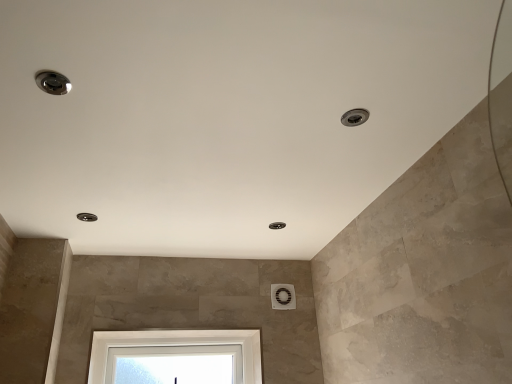
Measure the distance between point (38, 73) and camera.

Point (38, 73) and camera are 3.55 feet apart from each other.

Identify the location of satin nickel droplight at upper right, which ranks as the 2th droplight in front-to-back order. Image resolution: width=512 pixels, height=384 pixels. (355, 117).

What do you see at coordinates (355, 117) in the screenshot? The image size is (512, 384). I see `satin nickel droplight at upper right, which appears as the first droplight when viewed from the right` at bounding box center [355, 117].

I want to click on matte silver droplight at upper left, positioned as the 1th droplight in left-to-right order, so click(87, 217).

Find the location of a particular element. The width and height of the screenshot is (512, 384). satin nickel droplight at upper left, acting as the 3th droplight starting from the back is located at coordinates (53, 82).

Considering the positions of point (84, 219) and point (68, 90), is point (84, 219) closer or farther from the camera than point (68, 90)?

Clearly, point (84, 219) is more distant from the camera than point (68, 90).

Looking at this image, considering the sizes of objects matte silver droplight at upper left, the 1th droplight ordered from the bottom, and satin nickel droplight at upper left, acting as the 3th droplight starting from the back, in the image provided, who is thinner, matte silver droplight at upper left, the 1th droplight ordered from the bottom, or satin nickel droplight at upper left, acting as the 3th droplight starting from the back,?

satin nickel droplight at upper left, acting as the 3th droplight starting from the back.

Can you confirm if matte silver droplight at upper left, the 1th droplight from the back, is smaller than satin nickel droplight at upper left, placed as the third droplight when sorted from bottom to top?

Yes.

From the image's perspective, is satin nickel droplight at upper right, the second droplight positioned from the top, located above or below satin nickel droplight at upper left, acting as the 3th droplight starting from the back?

satin nickel droplight at upper right, the second droplight positioned from the top, is below satin nickel droplight at upper left, acting as the 3th droplight starting from the back.

Considering their positions, is satin nickel droplight at upper right, which ranks as the second droplight in bottom-to-top order, located in front of or behind satin nickel droplight at upper left, the first droplight viewed from the front?

Clearly, satin nickel droplight at upper right, which ranks as the second droplight in bottom-to-top order, is behind satin nickel droplight at upper left, the first droplight viewed from the front.

Identify the location of droplight located above the satin nickel droplight at upper right, the second droplight positioned from the top (from the image's perspective). The width and height of the screenshot is (512, 384). (53, 82).

How much distance is there between satin nickel droplight at upper right, which ranks as the 2th droplight in front-to-back order, and satin nickel droplight at upper left, acting as the 3th droplight starting from the back?

A distance of 32.17 inches exists between satin nickel droplight at upper right, which ranks as the 2th droplight in front-to-back order, and satin nickel droplight at upper left, acting as the 3th droplight starting from the back.

How different are the orientations of satin nickel droplight at upper left, the first droplight viewed from the front, and matte silver droplight at upper left, the 3th droplight in the top-to-bottom sequence, in degrees?

The facing directions of satin nickel droplight at upper left, the first droplight viewed from the front, and matte silver droplight at upper left, the 3th droplight in the top-to-bottom sequence, are 90 degrees apart.

In the scene shown: Could you tell me if satin nickel droplight at upper left, the 2th droplight positioned from the right, is turned towards matte silver droplight at upper left, the 3th droplight viewed from the front?

No, satin nickel droplight at upper left, the 2th droplight positioned from the right, is not aimed at matte silver droplight at upper left, the 3th droplight viewed from the front.

Locate an element on the screen. the 2nd droplight in front of the matte silver droplight at upper left, the 3th droplight in the top-to-bottom sequence, counting from the anchor's position is located at coordinates (53, 82).

Considering the relative positions of satin nickel droplight at upper left, the first droplight viewed from the front, and matte silver droplight at upper left, positioned as the 1th droplight in left-to-right order, in the image provided, is satin nickel droplight at upper left, the first droplight viewed from the front, to the left or to the right of matte silver droplight at upper left, positioned as the 1th droplight in left-to-right order,?

Clearly, satin nickel droplight at upper left, the first droplight viewed from the front, is on the right of matte silver droplight at upper left, positioned as the 1th droplight in left-to-right order, in the image.

Is matte silver droplight at upper left, the 1th droplight from the back, bigger than satin nickel droplight at upper right, which appears as the first droplight when viewed from the right?

Yes.

Is satin nickel droplight at upper right, which appears as the second droplight when viewed from the back, surrounded by matte silver droplight at upper left, the 3th droplight in the top-to-bottom sequence?

No, matte silver droplight at upper left, the 3th droplight in the top-to-bottom sequence, does not contain satin nickel droplight at upper right, which appears as the second droplight when viewed from the back.

This screenshot has height=384, width=512. What are the coordinates of `droplight above the matte silver droplight at upper left, the 3th droplight viewed from the front (from a real-world perspective)` in the screenshot? It's located at (355, 117).

Based on the photo, is matte silver droplight at upper left, the 1th droplight ordered from the bottom, not near satin nickel droplight at upper right, which appears as the second droplight when viewed from the back?

That's right, there is a large distance between matte silver droplight at upper left, the 1th droplight ordered from the bottom, and satin nickel droplight at upper right, which appears as the second droplight when viewed from the back.

Between satin nickel droplight at upper left, the first droplight viewed from the front, and satin nickel droplight at upper right, which ranks as the 2th droplight in front-to-back order, which one appears on the left side from the viewer's perspective?

satin nickel droplight at upper left, the first droplight viewed from the front.

Looking at this image, from a real-world perspective, which object stands above the other?

satin nickel droplight at upper right, which ranks as the 2th droplight in front-to-back order.

Could you tell me if satin nickel droplight at upper left, acting as the 3th droplight starting from the back, is turned towards satin nickel droplight at upper right, the second droplight positioned from the top?

Yes, satin nickel droplight at upper left, acting as the 3th droplight starting from the back, is turned towards satin nickel droplight at upper right, the second droplight positioned from the top.

In the scene shown: Who is bigger, satin nickel droplight at upper left, the first droplight viewed from the front, or satin nickel droplight at upper right, which appears as the first droplight when viewed from the right?

satin nickel droplight at upper left, the first droplight viewed from the front, is bigger.

Image resolution: width=512 pixels, height=384 pixels. Identify the location of the 1st droplight in front of the matte silver droplight at upper left, the 1th droplight from the back, counting from the anchor's position. (355, 117).

Based on the photo, considering the relative sizes of satin nickel droplight at upper right, which appears as the first droplight when viewed from the right, and matte silver droplight at upper left, positioned as the 1th droplight in left-to-right order, in the image provided, is satin nickel droplight at upper right, which appears as the first droplight when viewed from the right, shorter than matte silver droplight at upper left, positioned as the 1th droplight in left-to-right order,?

Correct, satin nickel droplight at upper right, which appears as the first droplight when viewed from the right, is not as tall as matte silver droplight at upper left, positioned as the 1th droplight in left-to-right order.

Is satin nickel droplight at upper right, which appears as the 3th droplight when viewed from the left, positioned behind matte silver droplight at upper left, the 3th droplight viewed from the front?

No, satin nickel droplight at upper right, which appears as the 3th droplight when viewed from the left, is closer to the camera.

From a real-world perspective, which droplight is the 1st one above the satin nickel droplight at upper left, the first droplight viewed from the front? Please provide its 2D coordinates.

[(87, 217)]

The height and width of the screenshot is (384, 512). Find the location of `the 1st droplight below when counting from the satin nickel droplight at upper left, placed as the third droplight when sorted from bottom to top (from the image's perspective)`. the 1st droplight below when counting from the satin nickel droplight at upper left, placed as the third droplight when sorted from bottom to top (from the image's perspective) is located at coordinates (355, 117).

Which object lies nearer to the anchor point satin nickel droplight at upper left, acting as the 3th droplight starting from the back, matte silver droplight at upper left, which is the 3th droplight in right-to-left order, or satin nickel droplight at upper right, which appears as the first droplight when viewed from the right?

satin nickel droplight at upper right, which appears as the first droplight when viewed from the right, is closer to satin nickel droplight at upper left, acting as the 3th droplight starting from the back.

Considering their positions, is satin nickel droplight at upper left, the 2th droplight positioned from the right, positioned further to matte silver droplight at upper left, the 1th droplight ordered from the bottom, than satin nickel droplight at upper right, which ranks as the 2th droplight in front-to-back order?

satin nickel droplight at upper right, which ranks as the 2th droplight in front-to-back order.

When comparing their distances from satin nickel droplight at upper right, the second droplight positioned from the top, does satin nickel droplight at upper left, acting as the second droplight starting from the left, or matte silver droplight at upper left, the 1th droplight ordered from the bottom, seem further?

Based on the image, matte silver droplight at upper left, the 1th droplight ordered from the bottom, appears to be further to satin nickel droplight at upper right, the second droplight positioned from the top.

From the picture: When comparing their distances from matte silver droplight at upper left, the 1th droplight ordered from the bottom, does satin nickel droplight at upper right, which ranks as the 2th droplight in front-to-back order, or satin nickel droplight at upper left, the first droplight viewed from the top, seem further?

satin nickel droplight at upper right, which ranks as the 2th droplight in front-to-back order, is positioned further to the anchor matte silver droplight at upper left, the 1th droplight ordered from the bottom.

When comparing their distances from satin nickel droplight at upper left, acting as the second droplight starting from the left, does satin nickel droplight at upper right, which appears as the 3th droplight when viewed from the left, or matte silver droplight at upper left, the 3th droplight in the top-to-bottom sequence, seem further?

matte silver droplight at upper left, the 3th droplight in the top-to-bottom sequence, is positioned further to the anchor satin nickel droplight at upper left, acting as the second droplight starting from the left.

Which object lies nearer to the anchor point satin nickel droplight at upper right, which appears as the 3th droplight when viewed from the left, matte silver droplight at upper left, the 3th droplight viewed from the front, or satin nickel droplight at upper left, placed as the third droplight when sorted from bottom to top?

satin nickel droplight at upper left, placed as the third droplight when sorted from bottom to top.

I want to click on droplight between matte silver droplight at upper left, positioned as the 1th droplight in left-to-right order, and satin nickel droplight at upper right, which ranks as the 2th droplight in front-to-back order, from left to right, so click(53, 82).